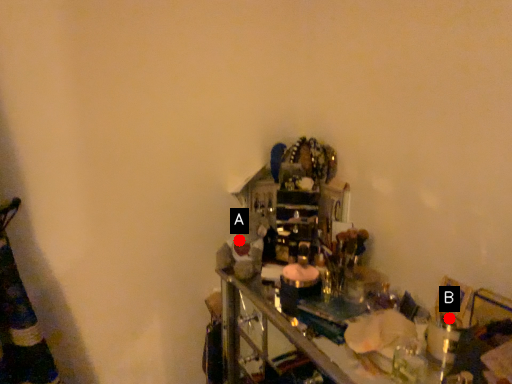
Question: Two points are circled on the image, labeled by A and B beside each circle. Among these points, which one is farthest from the camera?

Choices:
 (A) A is further
 (B) B is further

Answer: (A)